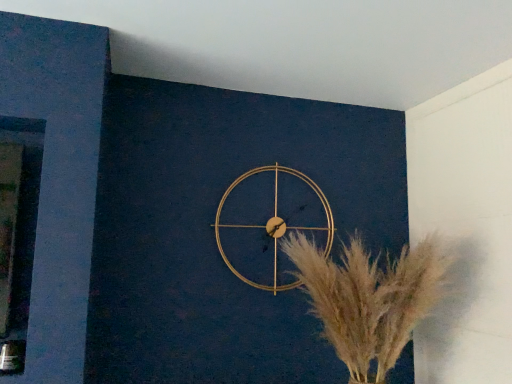
Question: From the image's perspective, is gold metallic wall clock at center positioned above or below silvery metallic pampas grass at center?

Choices:
 (A) below
 (B) above

Answer: (B)

Question: Is gold metallic wall clock at center wider or thinner than silvery metallic pampas grass at center?

Choices:
 (A) wide
 (B) thin

Answer: (B)

Question: Would you say gold metallic wall clock at center is inside or outside silvery metallic pampas grass at center?

Choices:
 (A) inside
 (B) outside

Answer: (B)

Question: Would you say silvery metallic pampas grass at center is inside or outside gold metallic wall clock at center?

Choices:
 (A) inside
 (B) outside

Answer: (B)

Question: From the image's perspective, is silvery metallic pampas grass at center located above or below gold metallic wall clock at center?

Choices:
 (A) above
 (B) below

Answer: (B)

Question: Considering the positions of silvery metallic pampas grass at center and gold metallic wall clock at center in the image, is silvery metallic pampas grass at center bigger or smaller than gold metallic wall clock at center?

Choices:
 (A) small
 (B) big

Answer: (B)

Question: Is silvery metallic pampas grass at center in front of or behind gold metallic wall clock at center in the image?

Choices:
 (A) behind
 (B) front

Answer: (B)